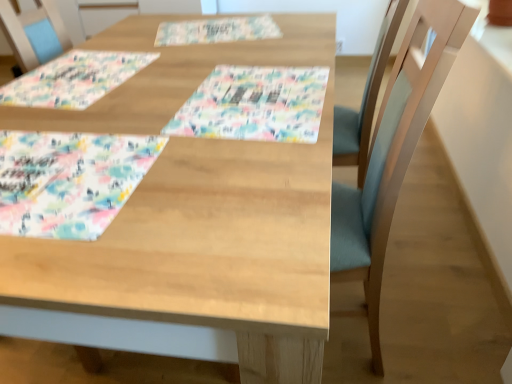
Question: Is floral paper placemat at upper center, which is counted as the third place mat, starting from the front, placed right next to wooden table at center?

Choices:
 (A) yes
 (B) no

Answer: (B)

Question: Considering the relative sizes of floral paper placemat at upper center, the 3th place mat from the bottom, and wooden table at center in the image provided, is floral paper placemat at upper center, the 3th place mat from the bottom, shorter than wooden table at center?

Choices:
 (A) no
 (B) yes

Answer: (B)

Question: Is floral paper placemat at upper center, which is counted as the 1th place mat, starting from the back, taller than wooden table at center?

Choices:
 (A) no
 (B) yes

Answer: (A)

Question: From a real-world perspective, is floral paper placemat at upper center, which is counted as the third place mat, starting from the front, on wooden table at center?

Choices:
 (A) no
 (B) yes

Answer: (B)

Question: Does floral paper placemat at upper center, which is counted as the third place mat, starting from the front, have a smaller size compared to wooden table at center?

Choices:
 (A) no
 (B) yes

Answer: (B)

Question: Is floral paper placemat at upper center, which is counted as the 1th place mat, starting from the back, oriented away from wooden table at center?

Choices:
 (A) yes
 (B) no

Answer: (A)

Question: Considering the relative positions of pastel floral fabric placemat at lower left, which is the 1th place mat from bottom to top, and floral paper placemat at upper center, which is the first place mat from top to bottom, in the image provided, is pastel floral fabric placemat at lower left, which is the 1th place mat from bottom to top, to the right of floral paper placemat at upper center, which is the first place mat from top to bottom, from the viewer's perspective?

Choices:
 (A) no
 (B) yes

Answer: (A)

Question: Would you say floral paper placemat at upper center, which is counted as the 1th place mat, starting from the back, is part of pastel floral fabric placemat at lower left, which ranks as the 3th place mat in back-to-front order,'s contents?

Choices:
 (A) yes
 (B) no

Answer: (B)

Question: Is pastel floral fabric placemat at lower left, which is the 1th place mat from bottom to top, next to floral paper placemat at upper center, which is counted as the 1th place mat, starting from the back?

Choices:
 (A) yes
 (B) no

Answer: (B)

Question: Is pastel floral fabric placemat at lower left, the 3th place mat from the top, closer to camera compared to floral paper placemat at upper center, which is counted as the 1th place mat, starting from the back?

Choices:
 (A) no
 (B) yes

Answer: (B)

Question: Does pastel floral fabric placemat at lower left, which is the 1th place mat from bottom to top, have a greater height compared to floral paper placemat at upper center, which is counted as the third place mat, starting from the front?

Choices:
 (A) no
 (B) yes

Answer: (B)

Question: Is pastel floral fabric placemat at lower left, which ranks as the 3th place mat in back-to-front order, oriented towards floral paper placemat at upper center, which is the first place mat from top to bottom?

Choices:
 (A) yes
 (B) no

Answer: (B)

Question: From the image's perspective, is pastel floral fabric placemat at lower left, which is the 1th place mat from bottom to top, below wooden table at center?

Choices:
 (A) yes
 (B) no

Answer: (B)